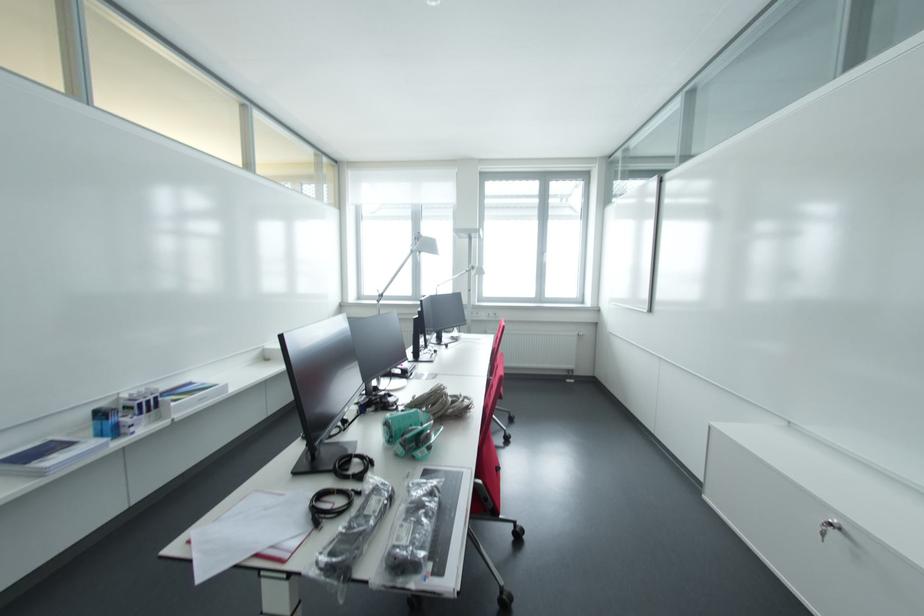
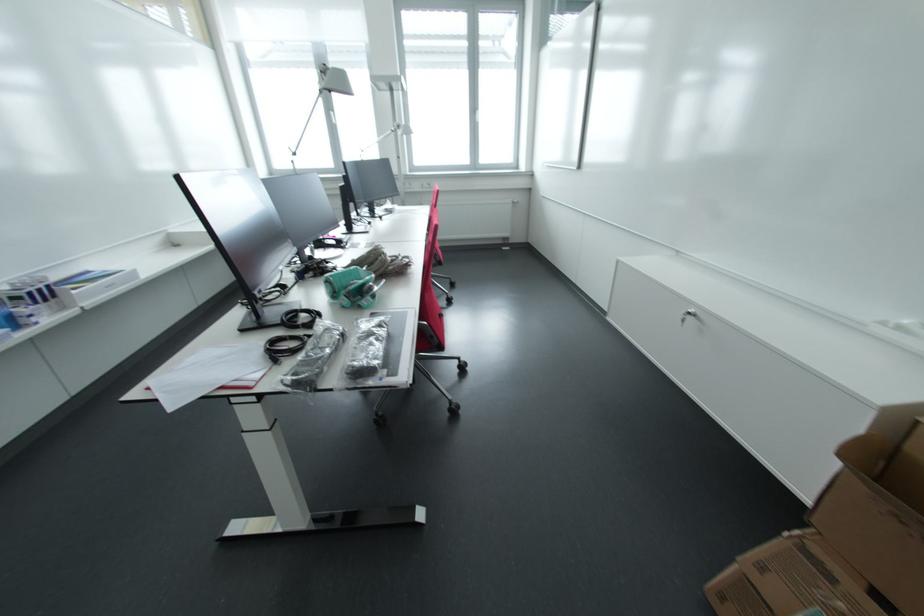
Question: Based on the continuous images, in which direction is the camera rotating? Reply with the corresponding letter.

Choices:
 (A) Left
 (B) Right
 (C) Up
 (D) Down

Answer: (D)